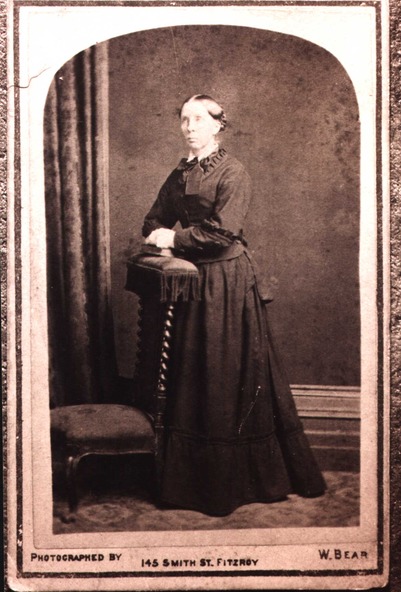
At what (x,y) coordinates should I click in order to perform the action: click on moulding. Please return your answer as a coordinate pair (x, y). Looking at the image, I should click on (333, 424).